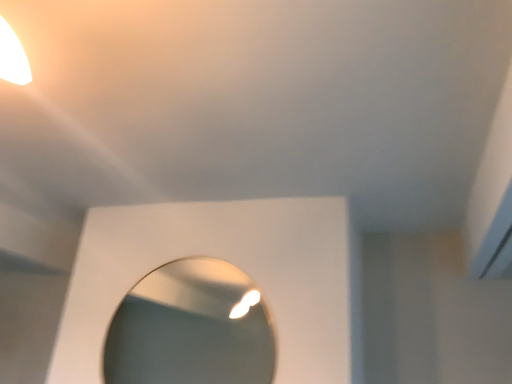
Where is `shiny silver mirror at center`? shiny silver mirror at center is located at coordinates (191, 328).

Describe the element at coordinates (191, 328) in the screenshot. The image size is (512, 384). I see `shiny silver mirror at center` at that location.

This screenshot has height=384, width=512. Identify the location of shiny silver mirror at center. (191, 328).